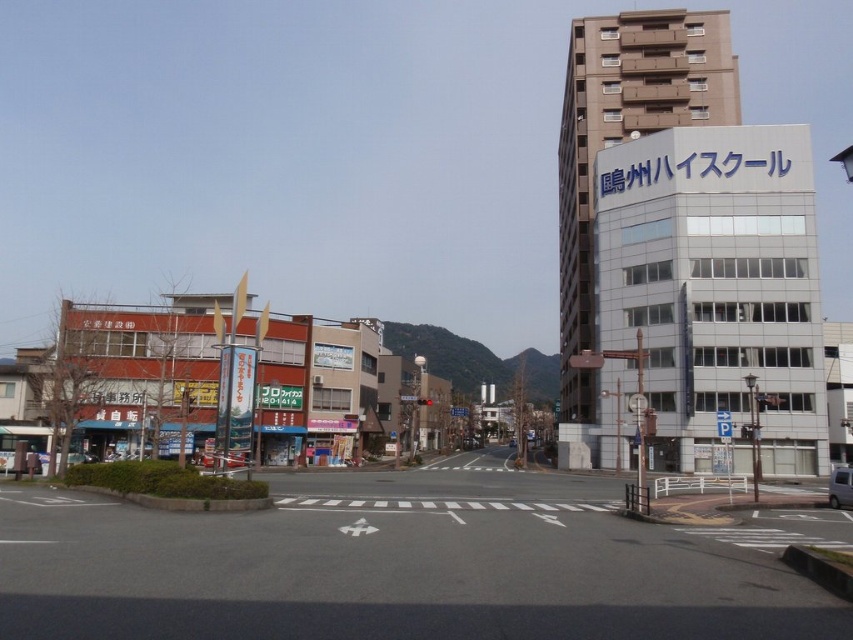
Question: Among these points, which one is farthest from the camera?

Choices:
 (A) (221, 456)
 (B) (828, 497)

Answer: (B)

Question: Is black asphalt road at center to the right of silver metallic van at lower right from the viewer's perspective?

Choices:
 (A) yes
 (B) no

Answer: (B)

Question: Estimate the real-world distances between objects in this image. Which object is closer to the black asphalt road at center?

Choices:
 (A) metallic silver car at center
 (B) silver metallic van at lower right

Answer: (A)

Question: Can you confirm if black asphalt road at center is wider than metallic silver car at center?

Choices:
 (A) no
 (B) yes

Answer: (B)

Question: Can you confirm if black asphalt road at center is smaller than metallic silver car at center?

Choices:
 (A) yes
 (B) no

Answer: (B)

Question: Among these objects, which one is nearest to the camera?

Choices:
 (A) metallic silver car at center
 (B) silver metallic van at lower right

Answer: (A)